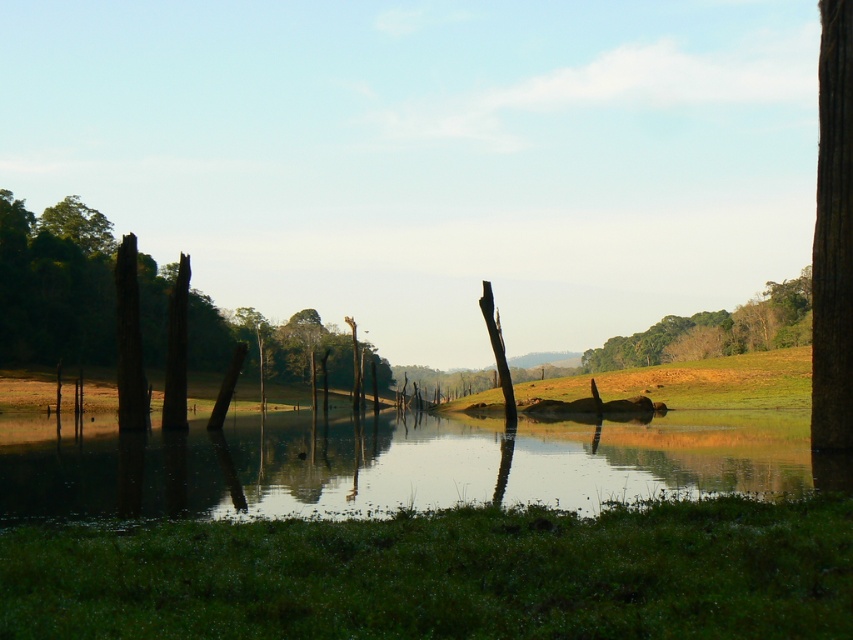
You are standing in the natural landscape and want to take a photo of both the smooth brown tree trunk at left and the green leafy tree at upper left. Which object should you focus on first to ensure both are in the frame?

You should focus on the smooth brown tree trunk at left first because it is closer to you than the green leafy tree at upper left, ensuring both are in the frame when adjusting the camera.

You are standing at the edge of the serene landscape and want to cross the water area. The clear water at center and the green leafy tree at upper left are visible. Which object has a wider span from your perspective?

The clear water at center has a wider span than the green leafy tree at upper left, as its width surpasses the tree.

You are standing on the grassy area in the foreground of the scene and want to reach the dense forest in the midground. Which direction should you move to avoid the clear water at center?

You should move towards the dense forest in the midground while avoiding the clear water at center located at point (392, 464). Since the water is at the center, moving towards the midground directly would lead you past it. To avoid it, you should move either to the left or right along the grassy area until reaching the forest area beyond.